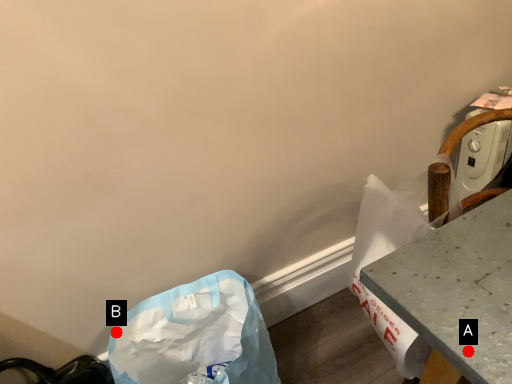
Question: Two points are circled on the image, labeled by A and B beside each circle. Which point is farther to the camera?

Choices:
 (A) A is further
 (B) B is further

Answer: (B)